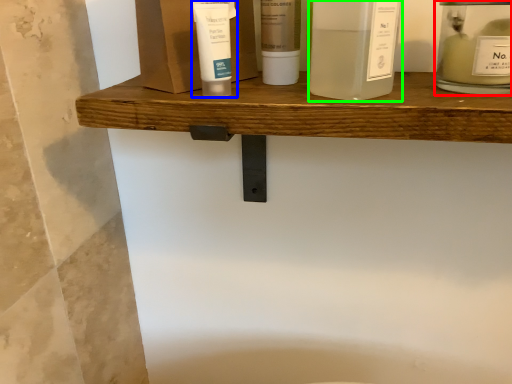
Question: Based on their relative distances, which object is farther from toiletry (highlighted by a red box)? Choose from toiletry (highlighted by a blue box) and product (highlighted by a green box).

Choices:
 (A) toiletry
 (B) product

Answer: (A)